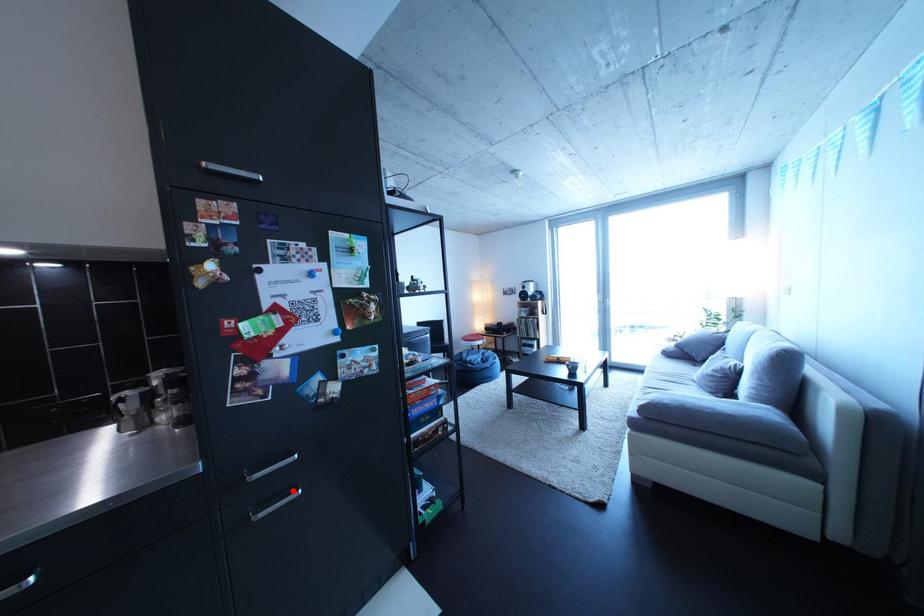
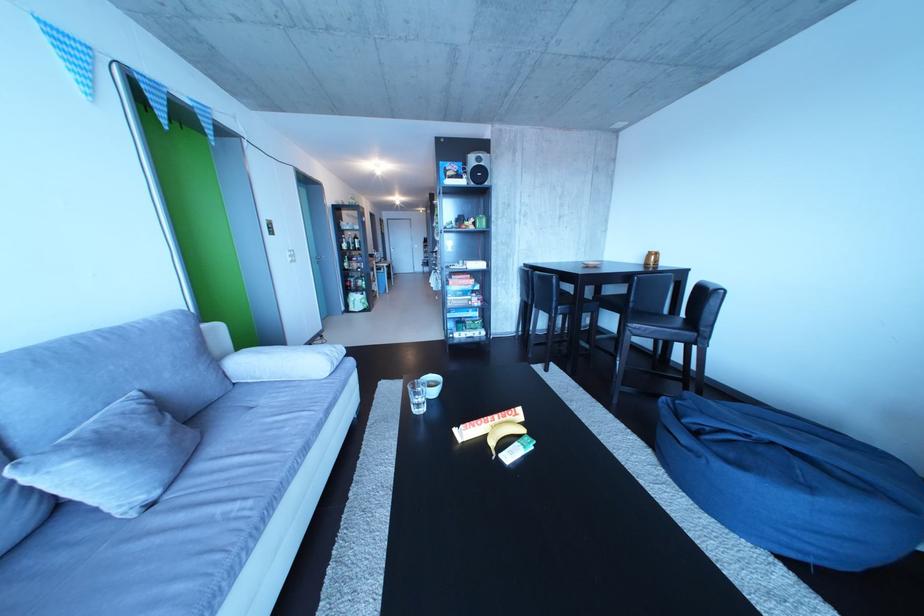
Question: I am providing you with two images of the same scene from different viewpoints. A red point is marked on the first image. Is the red point's position out of view in image 2?

Choices:
 (A) Yes
 (B) No

Answer: (A)